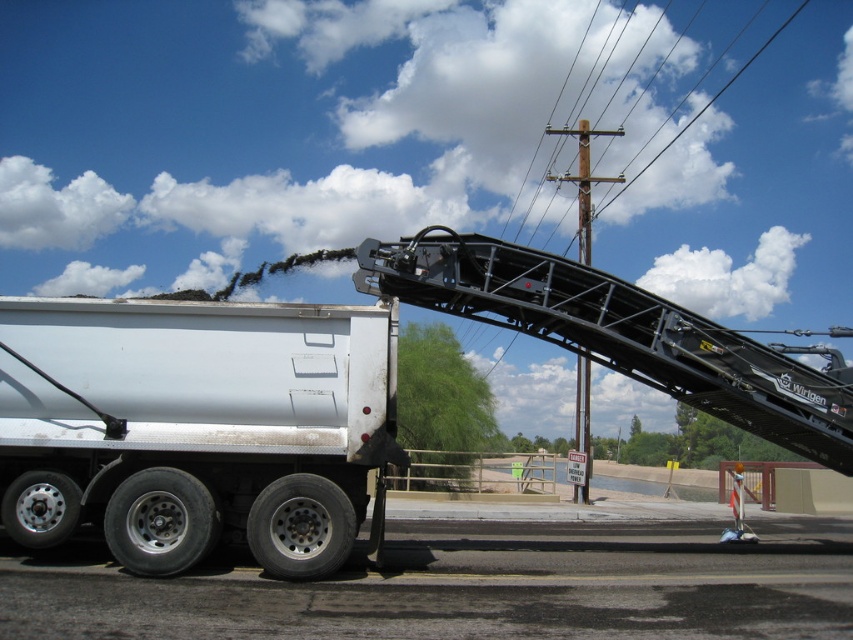
Question: Among these objects, which one is farthest from the camera?

Choices:
 (A) brown wooden telegraph pole at upper center
 (B) white matte truck at lower left

Answer: (A)

Question: Is white matte truck at lower left smaller than brown wooden telegraph pole at upper center?

Choices:
 (A) no
 (B) yes

Answer: (B)

Question: Which is farther from the black metal power line at upper center?

Choices:
 (A) white matte truck at lower left
 (B) brown wooden telegraph pole at upper center

Answer: (A)

Question: Does white matte truck at lower left have a smaller size compared to black metal power line at upper center?

Choices:
 (A) no
 (B) yes

Answer: (B)

Question: Which point appears closest to the camera in this image?

Choices:
 (A) (666, 144)
 (B) (573, 131)
 (C) (289, 426)

Answer: (C)

Question: Does white matte truck at lower left have a larger size compared to brown wooden telegraph pole at upper center?

Choices:
 (A) yes
 (B) no

Answer: (B)